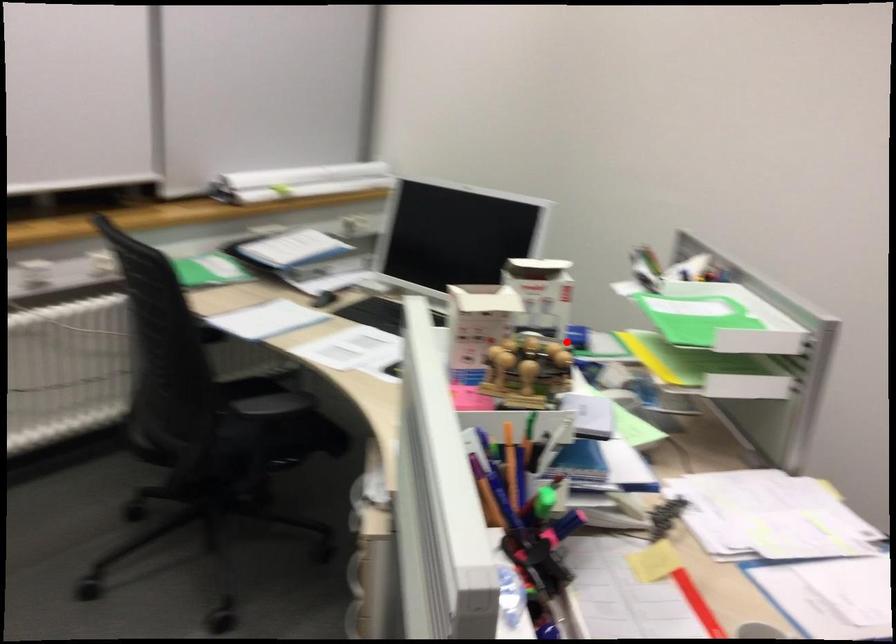
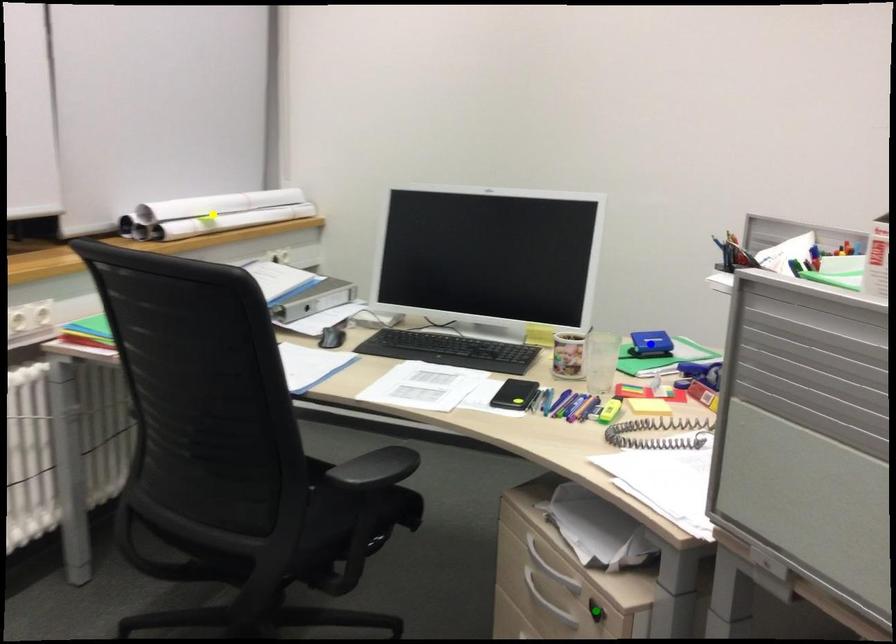
Question: I am providing you with two images of the same scene from different viewpoints. A red point is marked on the first image. You are given multiple points on the second image. Which point in image 2 is actually the same real-world point as the red point in image 1?

Choices:
 (A) blue point
 (B) green point
 (C) yellow point

Answer: (A)